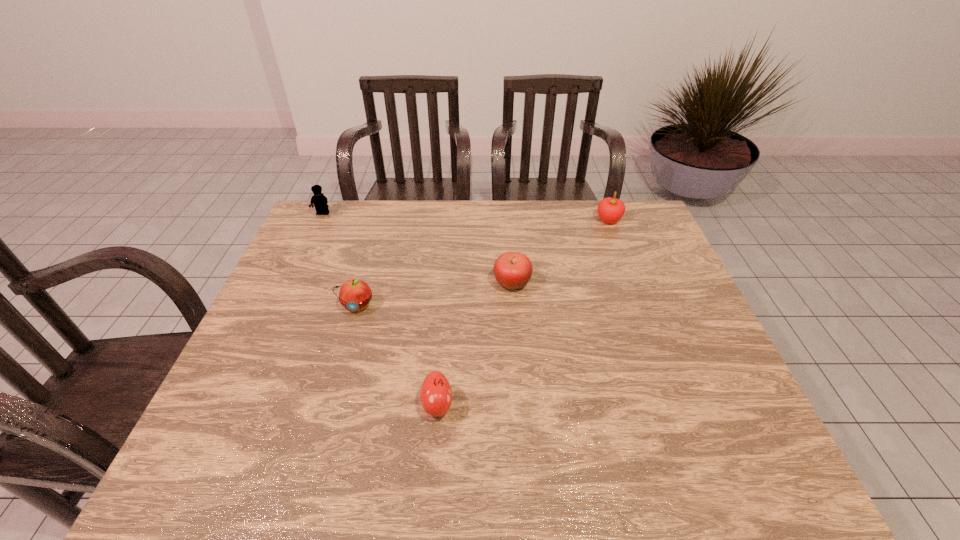
Find the location of a particular element. The height and width of the screenshot is (540, 960). vacant space situated 0.140m on the left of the leftmost apple is located at coordinates (288, 306).

I want to click on vacant region located on the right of the third object from right to left, so click(x=525, y=406).

Identify the location of Lego that is positioned at the far edge. (320, 202).

Locate an element on the screen. The image size is (960, 540). apple located in the far edge section of the desktop is located at coordinates (610, 210).

At what (x,y) coordinates should I click in order to perform the action: click on object that is at the left edge. Please return your answer as a coordinate pair (x, y). Looking at the image, I should click on (320, 202).

Identify the location of object at the right edge. Image resolution: width=960 pixels, height=540 pixels. (610, 210).

Image resolution: width=960 pixels, height=540 pixels. I want to click on object that is at the far left corner, so click(320, 202).

The width and height of the screenshot is (960, 540). I want to click on object that is at the far right corner, so click(610, 210).

This screenshot has height=540, width=960. Identify the location of free region at the far edge of the desktop. (477, 202).

You are a GUI agent. You are given a task and a screenshot of the screen. Output one action in this format:
    pyautogui.click(x=<x>, y=<y>)
    Task: Click on the free space at the near edge
    The width and height of the screenshot is (960, 540).
    Given the screenshot: What is the action you would take?
    pyautogui.click(x=551, y=481)